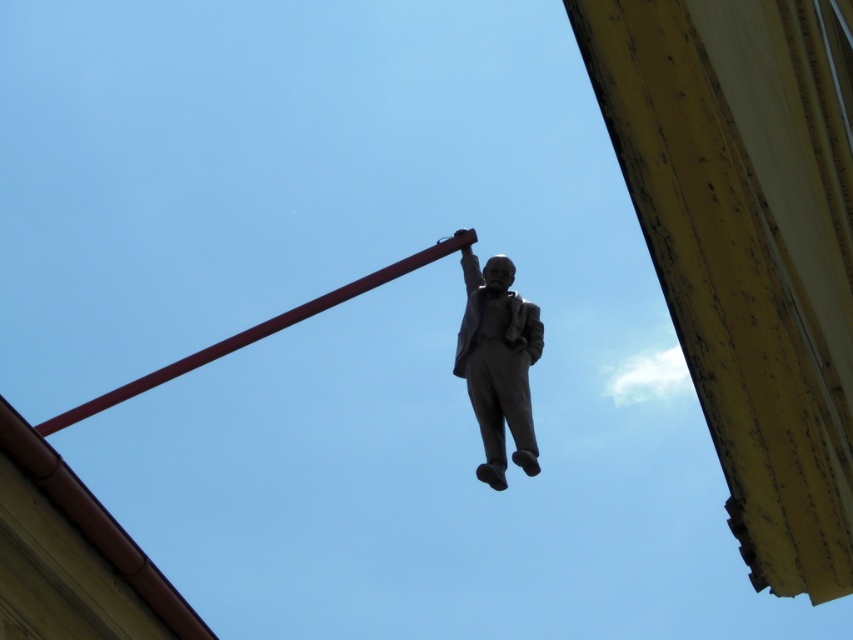
Question: Is bronze statue at center smaller than smooth red pole at center?

Choices:
 (A) yes
 (B) no

Answer: (A)

Question: Which of the following is the closest to the observer?

Choices:
 (A) (497, 272)
 (B) (465, 244)

Answer: (A)

Question: Which point is closer to the camera taking this photo?

Choices:
 (A) (485, 396)
 (B) (265, 336)

Answer: (A)

Question: Which point appears farthest from the camera in this image?

Choices:
 (A) (515, 406)
 (B) (235, 342)

Answer: (B)

Question: Does bronze statue at center appear on the left side of smooth red pole at center?

Choices:
 (A) yes
 (B) no

Answer: (B)

Question: Can you confirm if bronze statue at center is smaller than smooth red pole at center?

Choices:
 (A) yes
 (B) no

Answer: (A)